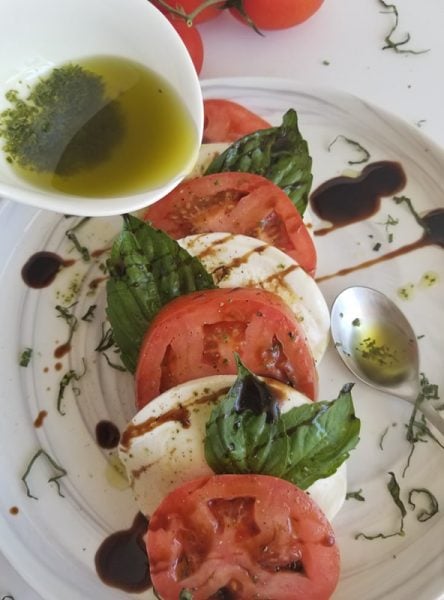
Where is `silver spoon`? Image resolution: width=444 pixels, height=600 pixels. silver spoon is located at coordinates pyautogui.click(x=370, y=317).